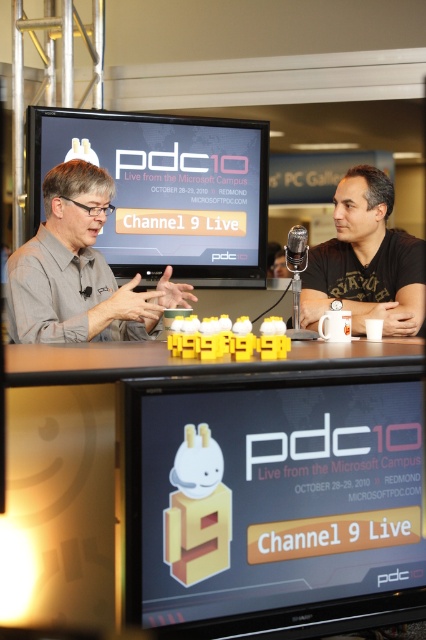
Is matte black monitor at center above black plastic microphone at center?

Yes.

Between matte black monitor at center and black plastic microphone at center, which one appears on the right side from the viewer's perspective?

Positioned to the right is black plastic microphone at center.

From the picture: Measure the distance between point [155,246] and camera.

Point [155,246] and camera are 3.25 meters apart from each other.

Identify the location of matte black monitor at center. (166, 189).

Which is more to the left, gray matte shirt at left or black matte t-shirt at right?

Positioned to the left is gray matte shirt at left.

Which of these two, gray matte shirt at left or black matte t-shirt at right, stands taller?

black matte t-shirt at right is taller.

Locate an element on the screen. gray matte shirt at left is located at coordinates (78, 269).

Where is `gray matte shirt at left`? gray matte shirt at left is located at coordinates (78, 269).

Between matte black monitor at center and gray matte shirt at left, which one has more height?

matte black monitor at center

Is matte black monitor at center shorter than gray matte shirt at left?

No.

At what (x,y) coordinates should I click in order to perform the action: click on matte black monitor at center. Please return your answer as a coordinate pair (x, y). Looking at the image, I should click on click(x=166, y=189).

This screenshot has width=426, height=640. I want to click on matte black monitor at center, so click(x=166, y=189).